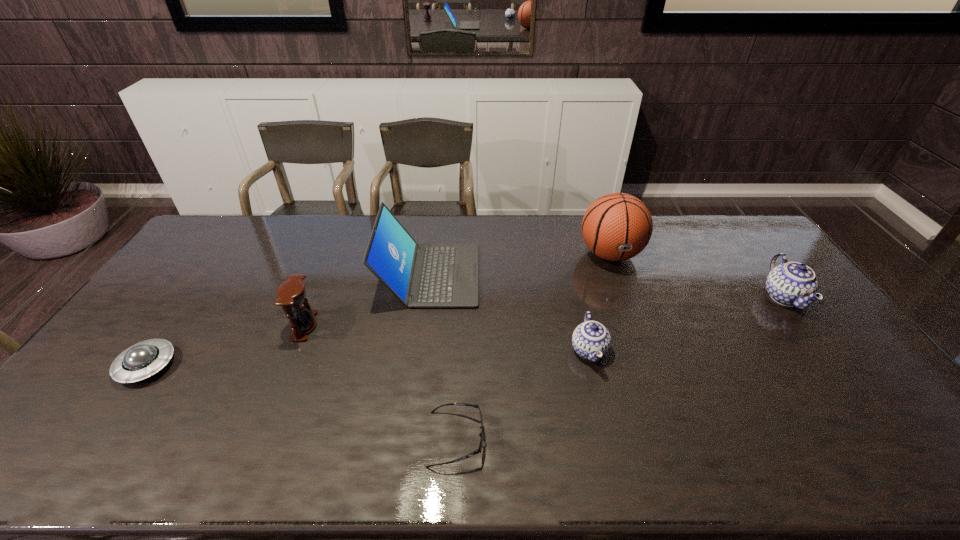
Locate an element on the screen. free space that satisfies the following two spatial constraints: 1. on the side where the inflation valve is located; 2. on the screen of the second tallest object is located at coordinates (617, 275).

What are the coordinates of `vacant space that satisfies the following two spatial constraints: 1. at the spout of the rightmost object; 2. at the spout of the third shortest object` in the screenshot? It's located at (824, 350).